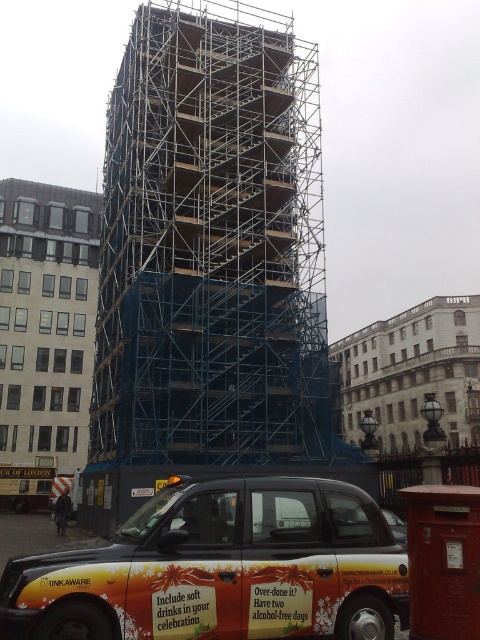
You are a construction worker standing at the origin point of the coordinate system. You need to move towards the blue metallic scaffolding at center. What are the coordinates you should head towards?

The blue metallic scaffolding at center is located at point [212,244], so you should head towards those coordinates.

You are a pedestrian standing on the sidewalk. You see the blue metallic scaffolding at center and the orange painted taxi at lower center. Which object is closer to you?

The blue metallic scaffolding at center is closer to you because it is further to the viewer than the orange painted taxi at lower center.

You are a construction worker standing at the point marked by the coordinates (212, 244). What structure are you currently on?

The point (212, 244) is on the blue metallic scaffolding at center, so you are currently on the blue metallic scaffolding at center.